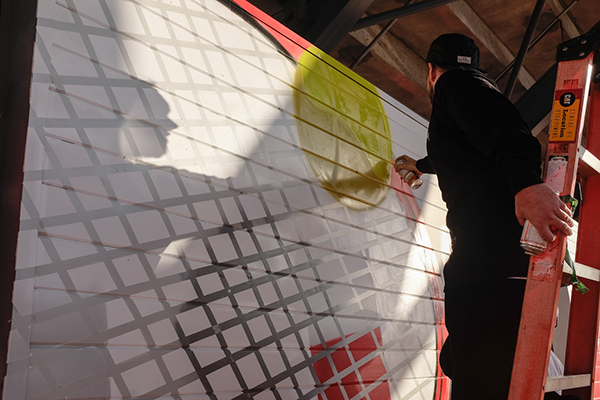
Identify the location of wood pillar ceilings. (504, 22), (406, 27).